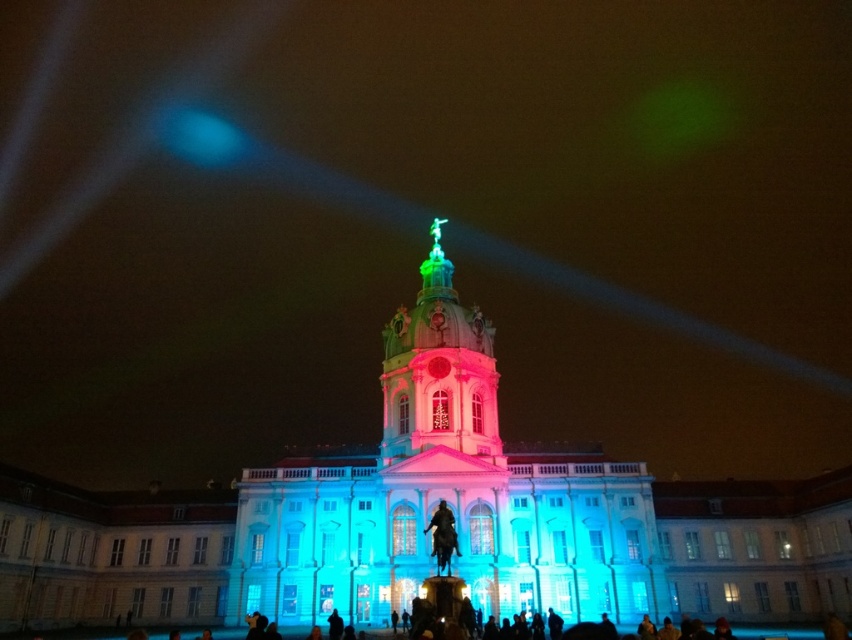
Question: Is polished stone tower at center to the left of shiny green dome at center from the viewer's perspective?

Choices:
 (A) no
 (B) yes

Answer: (A)

Question: Can you confirm if polished stone tower at center is smaller than shiny green dome at center?

Choices:
 (A) no
 (B) yes

Answer: (A)

Question: Which of the following is the farthest from the observer?

Choices:
 (A) (297, 531)
 (B) (459, 320)

Answer: (B)

Question: Is polished stone tower at center to the right of shiny green dome at center from the viewer's perspective?

Choices:
 (A) no
 (B) yes

Answer: (B)

Question: Which point is farther to the camera?

Choices:
 (A) (400, 413)
 (B) (493, 444)

Answer: (A)

Question: Which object appears farthest from the camera in this image?

Choices:
 (A) shiny green dome at center
 (B) polished stone tower at center

Answer: (A)